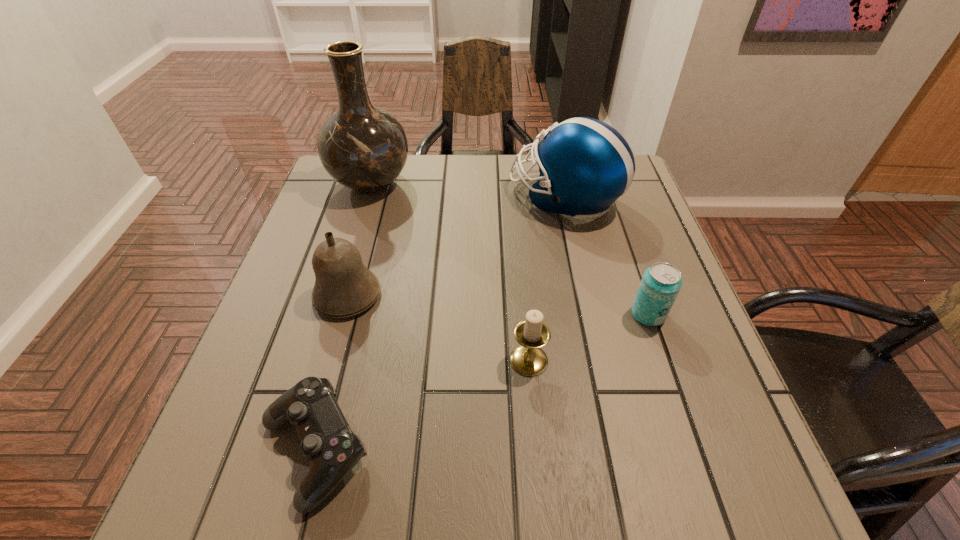
Where is `control positioned at the left edge`? control positioned at the left edge is located at coordinates (327, 442).

Locate an element on the screen. The width and height of the screenshot is (960, 540). football helmet located in the right edge section of the desktop is located at coordinates pos(585,165).

Locate an element on the screen. The image size is (960, 540). beer can at the right edge is located at coordinates (661, 283).

This screenshot has height=540, width=960. In order to click on object that is at the far left corner in this screenshot , I will do `click(363, 147)`.

At what (x,y) coordinates should I click in order to perform the action: click on object that is positioned at the near left corner. Please return your answer as a coordinate pair (x, y). Looking at the image, I should click on (327, 442).

You are a GUI agent. You are given a task and a screenshot of the screen. Output one action in this format:
    pyautogui.click(x=<x>, y=<y>)
    Task: Click on the object that is positioned at the far right corner
    Image resolution: width=960 pixels, height=540 pixels.
    Given the screenshot: What is the action you would take?
    pos(585,165)

The image size is (960, 540). Find the location of `blank space at the far edge`. blank space at the far edge is located at coordinates (402, 172).

In the image, there is a desktop. Where is `free space at the near edge`? The image size is (960, 540). free space at the near edge is located at coordinates (488, 516).

Where is `free space at the left edge of the desktop`? free space at the left edge of the desktop is located at coordinates (296, 303).

At what (x,y) coordinates should I click in order to perform the action: click on free space at the right edge. Please return your answer as a coordinate pair (x, y). The image size is (960, 540). Looking at the image, I should click on (738, 437).